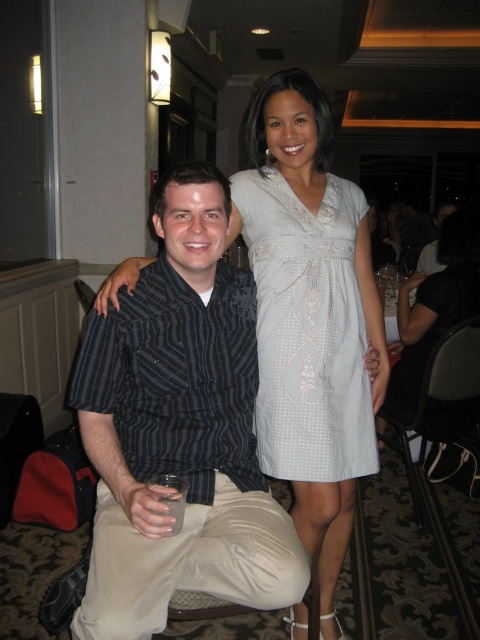
Which is behind, point (84, 384) or point (335, 404)?

The point (335, 404) is more distant.

Is striped cotton shirt at left to the right of light blue fabric dress at center from the viewer's perspective?

Incorrect, striped cotton shirt at left is not on the right side of light blue fabric dress at center.

Is point (226, 524) closer to viewer compared to point (331, 198)?

That is True.

This screenshot has height=640, width=480. Identify the location of striped cotton shirt at left. (179, 429).

Between point (171, 294) and point (410, 328), which one is positioned in front?

Point (171, 294)

Who is more forward, [253,460] or [472,282]?

Point [253,460]

You are a GUI agent. You are given a task and a screenshot of the screen. Output one action in this format:
    pyautogui.click(x=<x>, y=<y>)
    Task: Click on the striped cotton shirt at left
    Image resolution: width=480 pixels, height=640 pixels.
    Given the screenshot: What is the action you would take?
    pyautogui.click(x=179, y=429)

Which is behind, point (333, 188) or point (466, 252)?

Positioned behind is point (466, 252).

Does point (346, 188) come behind point (454, 307)?

That is False.

Who is more distant from viewer, (x=343, y=368) or (x=388, y=403)?

The point (x=388, y=403) is behind.

The height and width of the screenshot is (640, 480). I want to click on light blue fabric dress at center, so click(x=308, y=330).